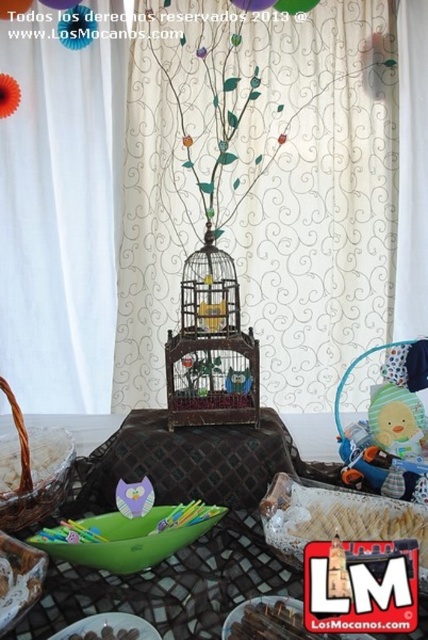
Question: Does brown woven basket at left have a larger size compared to brown matte chocolate at lower left?

Choices:
 (A) yes
 (B) no

Answer: (A)

Question: Which object is positioned closest to the white paper balloon at upper center?

Choices:
 (A) translucent plastic balloon at upper center
 (B) green plastic bowl at lower left
 (C) purple paper balloon at upper center

Answer: (C)

Question: Is green plastic bowl at center bigger than metallic wire birdcage at center?

Choices:
 (A) no
 (B) yes

Answer: (A)

Question: Which of the following is the closest to the observer?

Choices:
 (A) click(x=282, y=609)
 (B) click(x=291, y=12)
 (C) click(x=48, y=6)

Answer: (A)

Question: Which of the following is the farthest from the observer?

Choices:
 (A) (267, 4)
 (B) (56, 0)
 (C) (91, 624)

Answer: (B)

Question: Does brown matte chocolate at lower left have a lesser width compared to translucent paper balloon at upper left?

Choices:
 (A) no
 (B) yes

Answer: (B)